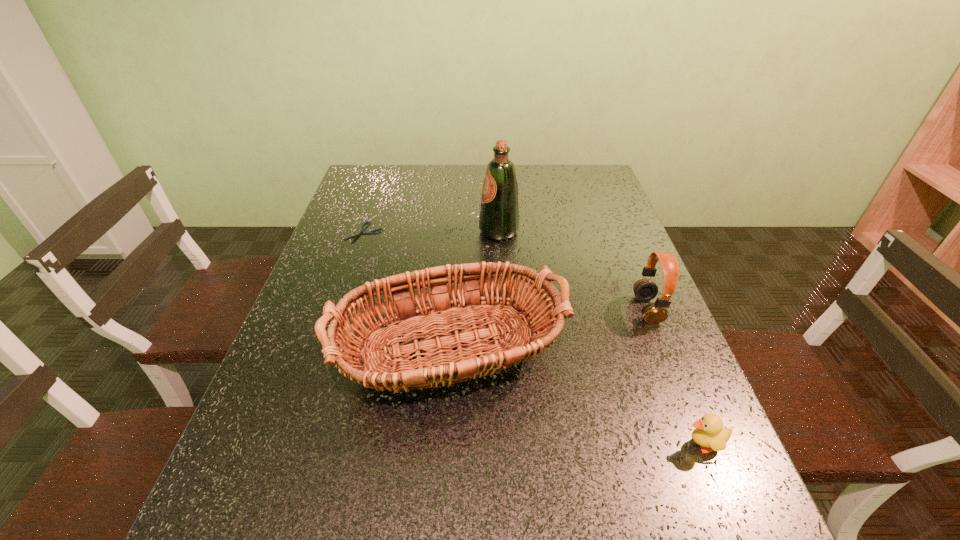
The height and width of the screenshot is (540, 960). What are the coordinates of `blank area located on the ear cups of the headset` in the screenshot? It's located at (504, 309).

Find the location of a particular element. Image resolution: width=960 pixels, height=540 pixels. free space located 0.320m on the ear cups of the headset is located at coordinates (499, 309).

This screenshot has width=960, height=540. Identify the location of free space located 0.240m on the front-facing side of the duckling. (547, 444).

Find the location of a particular element. The height and width of the screenshot is (540, 960). free space located on the front-facing side of the duckling is located at coordinates (496, 444).

Locate an element on the screen. This screenshot has height=540, width=960. free space located 0.080m on the front-facing side of the duckling is located at coordinates (637, 444).

The width and height of the screenshot is (960, 540). In order to click on free region located 0.250m on the back of the shears in this screenshot , I will do `click(382, 181)`.

Image resolution: width=960 pixels, height=540 pixels. Identify the location of basket that is at the left edge. (546, 316).

This screenshot has width=960, height=540. I want to click on shears at the left edge, so click(x=369, y=232).

You are a GUI agent. You are given a task and a screenshot of the screen. Output one action in this format:
    pyautogui.click(x=<x>, y=<y>)
    Task: Click on the headset situated at the right edge
    This screenshot has height=540, width=960.
    Given the screenshot: What is the action you would take?
    pyautogui.click(x=645, y=289)

The width and height of the screenshot is (960, 540). I want to click on duckling present at the right edge, so click(709, 433).